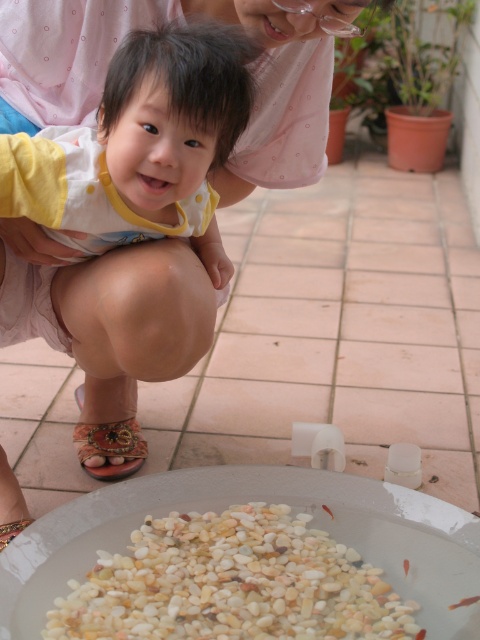
Question: Which object is farther from the camera taking this photo?

Choices:
 (A) leather floral sandal at lower left
 (B) white pebbles at bottom
 (C) yellow dotted fabric at center

Answer: (A)

Question: Which object is the farthest from the yellow dotted fabric at center?

Choices:
 (A) leather floral sandal at lower left
 (B) white pebbles at bottom

Answer: (B)

Question: Is white pebbles at bottom to the right of leather floral sandal at lower left from the viewer's perspective?

Choices:
 (A) yes
 (B) no

Answer: (A)

Question: Is white pebbles at bottom to the right of leather floral sandal at lower left from the viewer's perspective?

Choices:
 (A) no
 (B) yes

Answer: (B)

Question: Where is yellow dotted fabric at center located in relation to leather floral sandal at lower left in the image?

Choices:
 (A) left
 (B) right

Answer: (B)

Question: Estimate the real-world distances between objects in this image. Which object is farther from the yellow dotted fabric at center?

Choices:
 (A) leather floral sandal at lower left
 (B) white pebbles at bottom

Answer: (B)